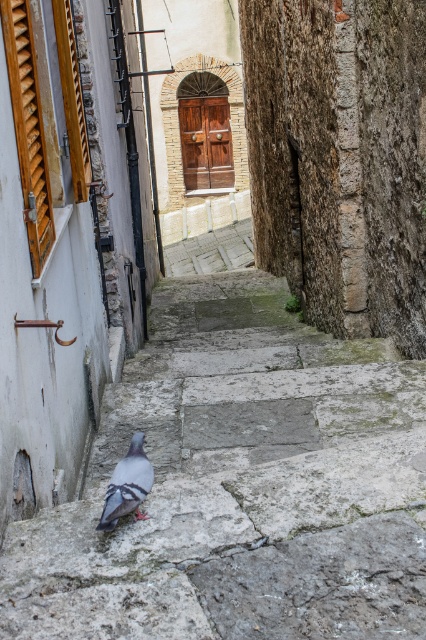
You are standing in the alleyway and see two points marked on the ground. The first point is at coordinate point[106,554] and the second is at point[126,465]. Which point is closer to you?

Point[106,554] is closer to the viewer than point[126,465].

You are a delivery person carrying a box that is 1.2 meters long. You need to walk through the alleyway and pass by the gray stone stairs at center and the gray matte pigeon at lower center. Can you safely carry your box through the narrow space between them without hitting anything?

The distance between the gray stone stairs at center and the gray matte pigeon at lower center is 1.07 meters. Since your box is 1.2 meters long, it is longer than the available space, so you cannot safely carry it through without hitting something.